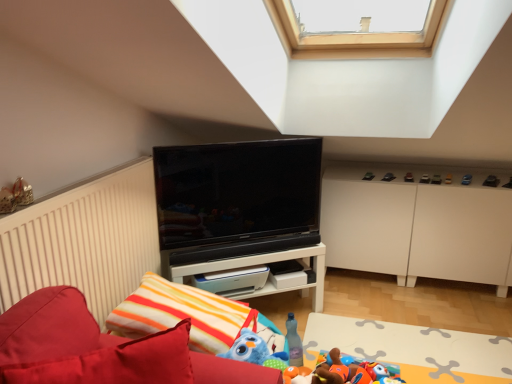
Question: Is matte black toy at upper center, acting as the 6th toy starting from the right, in front of or behind black glossy tv at center in the image?

Choices:
 (A) behind
 (B) front

Answer: (A)

Question: Is matte black toy at upper center, the 8th toy from the bottom, taller or shorter than black glossy tv at center?

Choices:
 (A) tall
 (B) short

Answer: (B)

Question: Based on their relative distances, which object is nearer to the metallic silver toy at upper right, the 5th toy positioned from the front?

Choices:
 (A) metallic silver toy car at right, which is the 3th toy from right to left
 (B) metallic gold ornament at upper left, which is the 2th toy in bottom-to-top order
 (C) blue plastic toy at upper right, the fifth toy when ordered from back to front
 (D) white matte cabinet at right
 (E) striped fabric pillow at lower center

Answer: (A)

Question: Estimate the real-world distances between objects in this image. Which object is closer to the matte black toy at upper center, marked as the 8th toy in a front-to-back arrangement?

Choices:
 (A) white matte cabinet at right
 (B) metallic gold ornament at upper left, which is the 2th toy in bottom-to-top order
 (C) metallic silver toy car at right, marked as the 5th toy in a bottom-to-top arrangement
 (D) black glossy tv at center
 (E) velvet red sofa at lower left

Answer: (C)